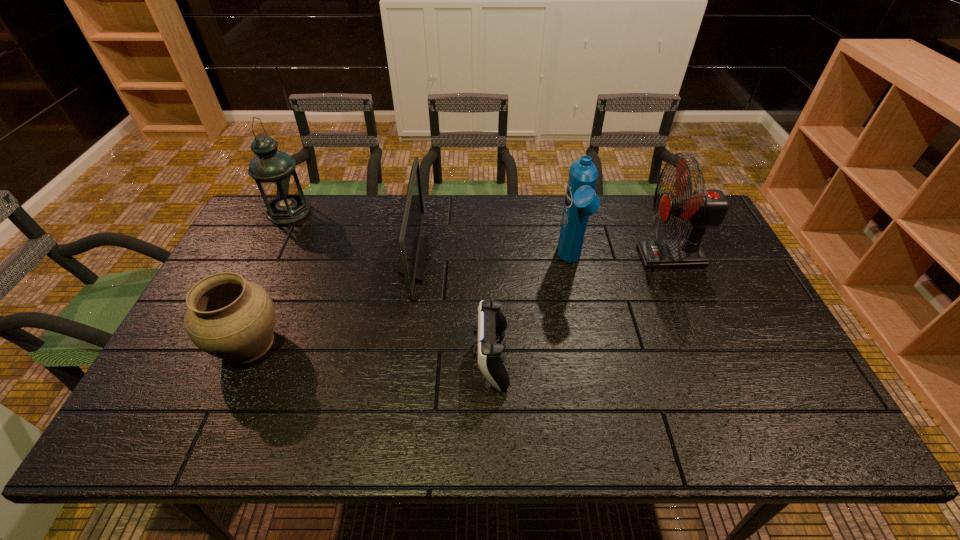
Locate an element on the screen. This screenshot has height=540, width=960. unoccupied position between the fifth tallest object and the shortest object is located at coordinates [x=370, y=350].

Select which object appears as the second closest to the fan. Please provide its 2D coordinates. Your answer should be formatted as a tuple, i.e. [(x, y)], where the tuple contains the x and y coordinates of a point satisfying the conditions above.

[(490, 319)]

The image size is (960, 540). Find the location of `object that stands as the fifth closest to the urn`. object that stands as the fifth closest to the urn is located at coordinates (704, 208).

Identify the location of free point that satisfies the following two spatial constraints: 1. on the back side of the shampoo; 2. on the screen side of the fourth object from right to left. (570, 260).

You are a GUI agent. You are given a task and a screenshot of the screen. Output one action in this format:
    pyautogui.click(x=<x>, y=<y>)
    Task: Click on the vacant space that satisfies the following two spatial constraints: 1. on the back side of the second shortest object; 2. on the right side of the fifth object from left to right
    
    Given the screenshot: What is the action you would take?
    pyautogui.click(x=284, y=262)

The height and width of the screenshot is (540, 960). What are the coordinates of `vacant area that satisfies the following two spatial constraints: 1. on the front-facing side of the fan; 2. on the front side of the urn` in the screenshot? It's located at (708, 343).